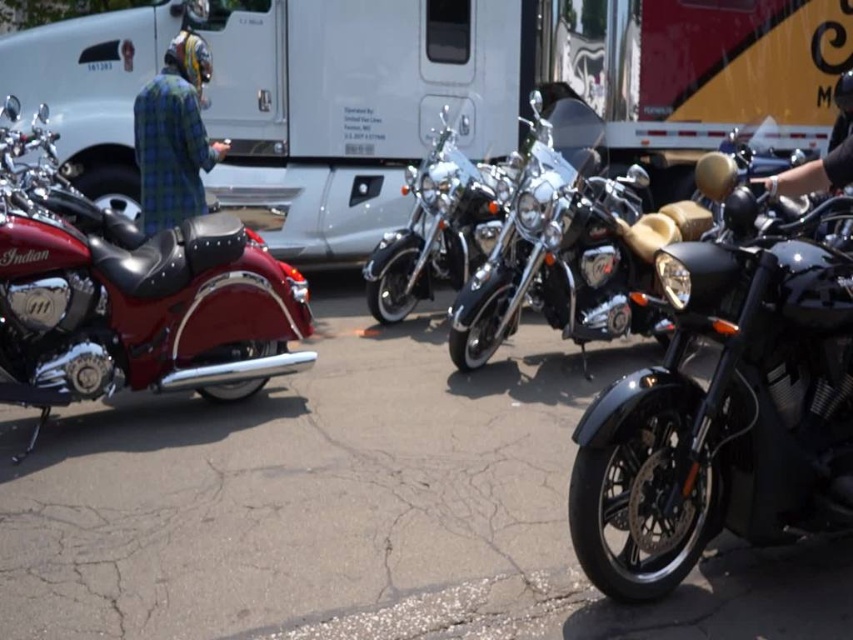
In the scene shown: You are standing at the point marked by the coordinates point (x=136, y=305) in the parking lot. What object are you standing on?

The point (x=136, y=305) indicates the shiny red leather motorcycle at left, so you are standing on the shiny red leather motorcycle at left.

You are standing at the point with coordinates point (422, 230) and want to move to the point with coordinates point (15, 220). Which direction should you move to reach your destination?

You should move forward because point (15, 220) is in front of point (422, 230).

You are a photographer setting up a shot of the shiny red leather motorcycle at left and the polished chrome motorcycle at center. You want to ensure both are visible in the frame. Based on their positions, which motorcycle is closer to the camera?

The shiny red leather motorcycle at left is positioned under the polished chrome motorcycle at center, meaning it is closer to the camera.